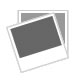
Where is `photo area`? The height and width of the screenshot is (80, 80). photo area is located at coordinates (26, 41), (60, 22).